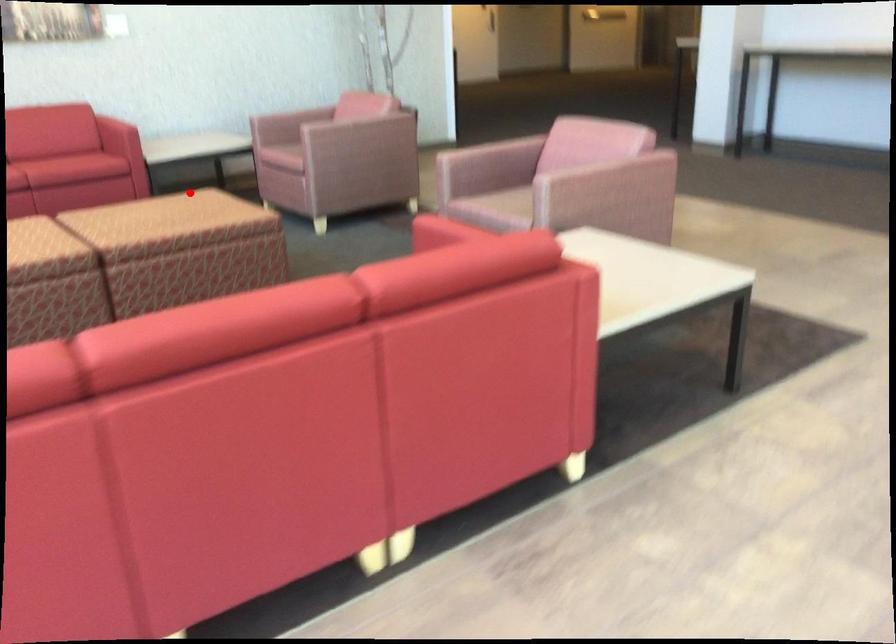
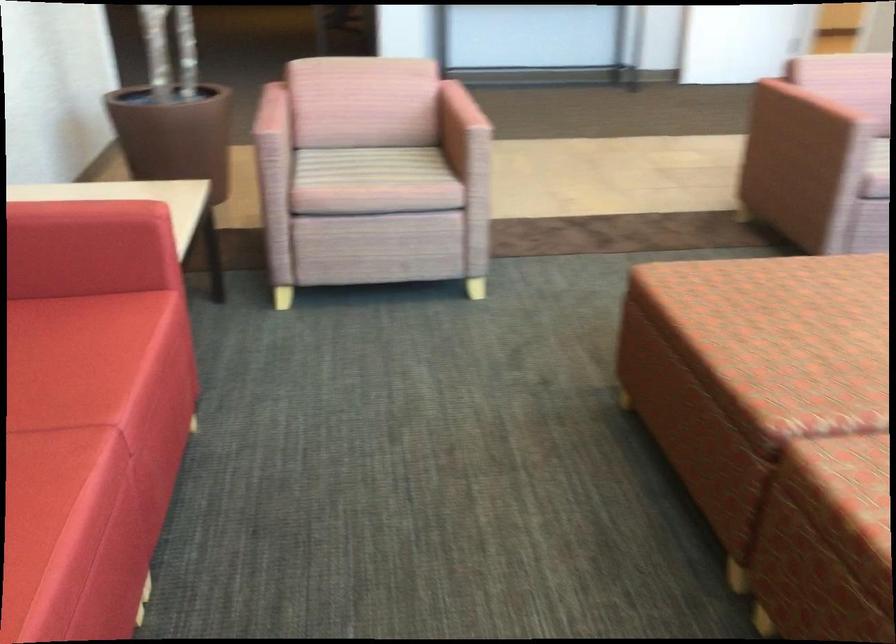
Where in the second image is the point corresponding to the highlighted location from the first image?

(805, 304)